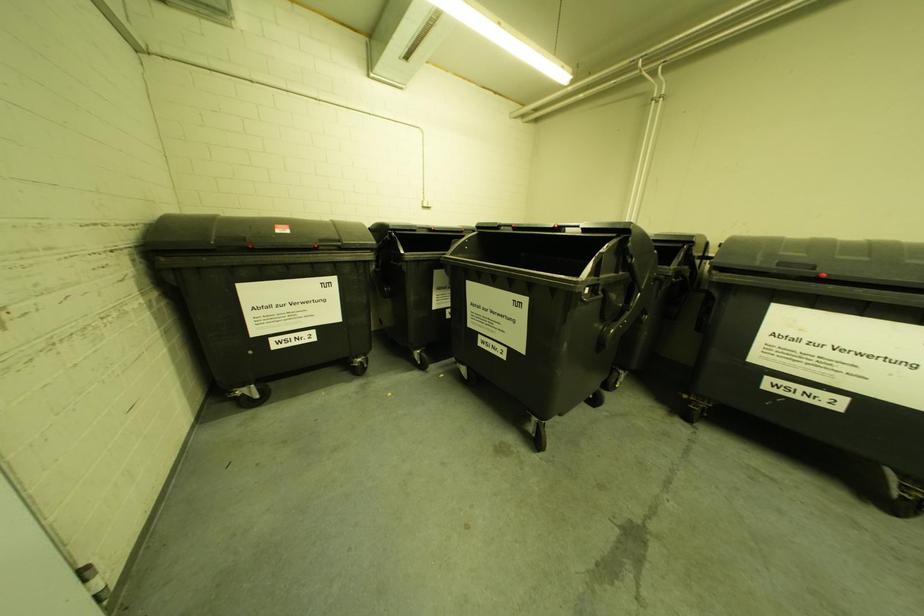
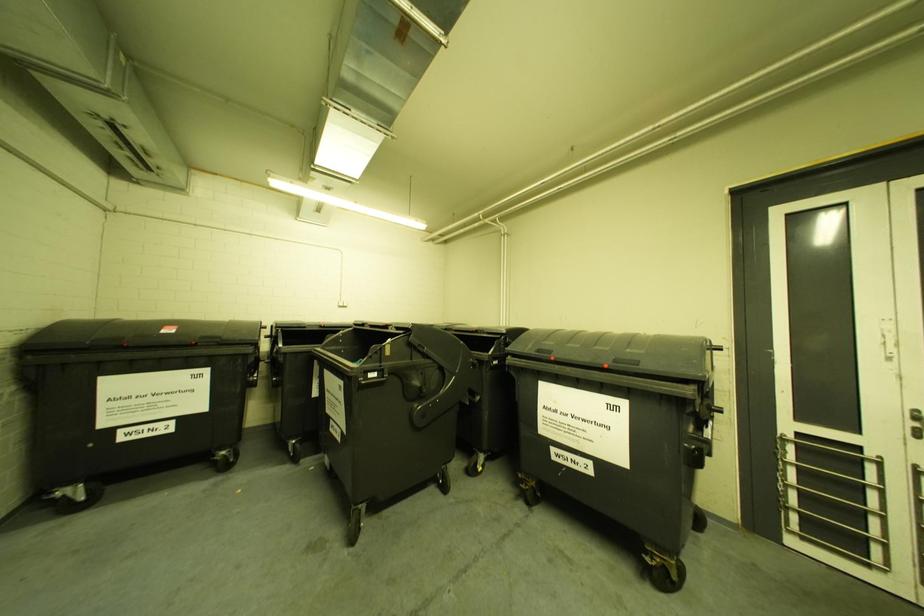
What movement of the cameraman would produce the second image?

The cameraman moved toward right, backward.